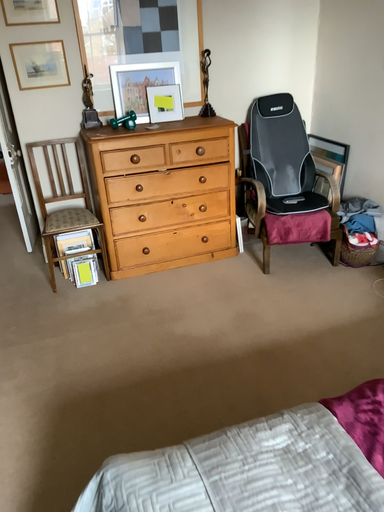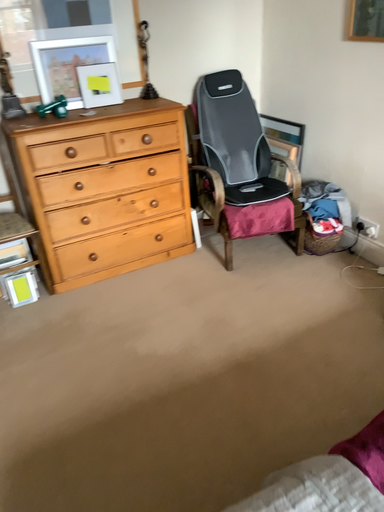
Question: How did the camera likely rotate when shooting the video?

Choices:
 (A) rotated left
 (B) rotated right

Answer: (B)